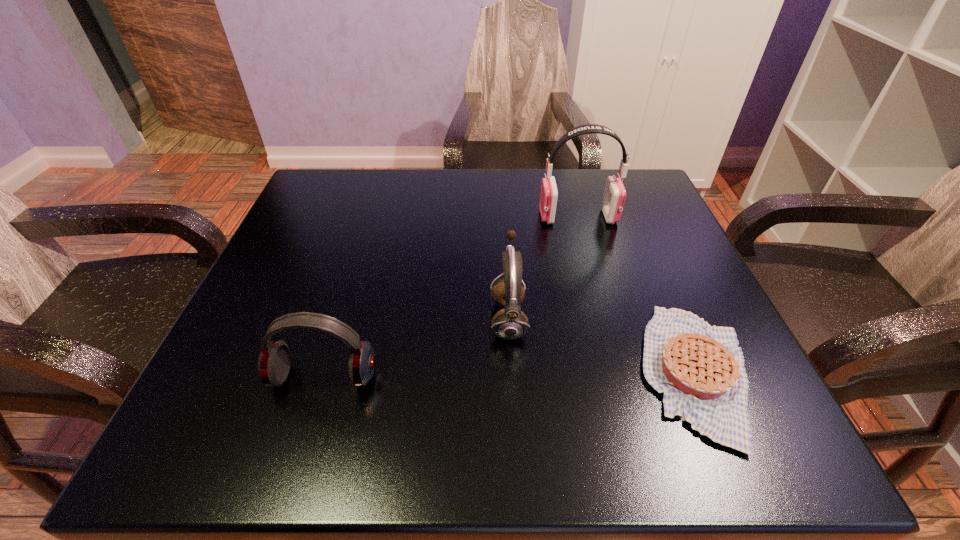
Where is `the farthest earphone`? the farthest earphone is located at coordinates (614, 195).

Locate an element on the screen. This screenshot has width=960, height=540. the tallest object is located at coordinates (614, 195).

Where is `the second tallest earphone`? The image size is (960, 540). the second tallest earphone is located at coordinates (510, 323).

Identify the location of the third shortest object. (510, 323).

Where is `the third tallest object`? the third tallest object is located at coordinates pyautogui.click(x=273, y=365).

You are a GUI agent. You are given a task and a screenshot of the screen. Output one action in this format:
    pyautogui.click(x=<x>, y=<y>)
    Task: Click on the leftmost object
    Image resolution: width=960 pixels, height=540 pixels.
    Given the screenshot: What is the action you would take?
    pyautogui.click(x=273, y=365)

Locate an element on the screen. the shortest object is located at coordinates (700, 369).

Where is `vacant region located on the outer surface of the tallest object`? The width and height of the screenshot is (960, 540). vacant region located on the outer surface of the tallest object is located at coordinates (495, 217).

This screenshot has height=540, width=960. In order to click on blank area located 0.110m on the outer surface of the tallest object in this screenshot , I will do `click(492, 217)`.

The image size is (960, 540). I want to click on free space located on the outer surface of the tallest object, so click(x=384, y=217).